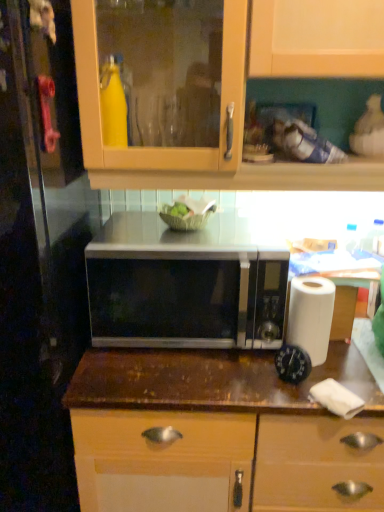
Where is `vacant area situated to the left side of white paper towel at lower right`? vacant area situated to the left side of white paper towel at lower right is located at coordinates (255, 386).